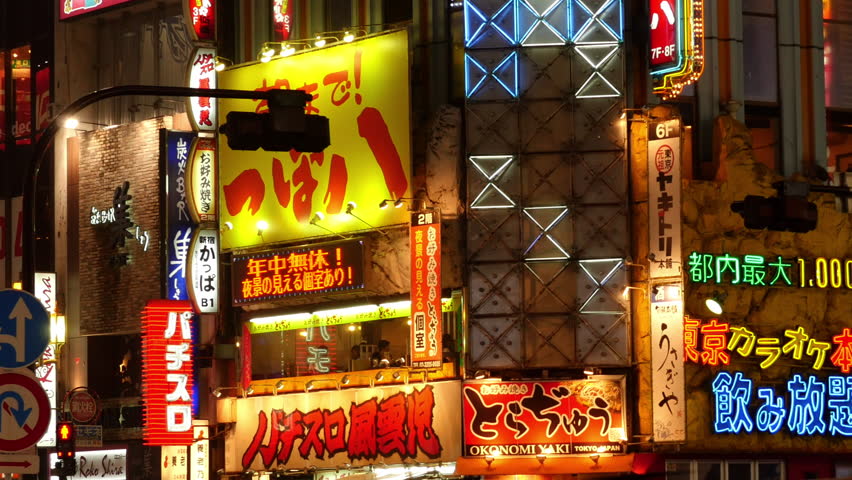
Find the location of `blue neon light chinese character`. blue neon light chinese character is located at coordinates (847, 409), (799, 406), (774, 417), (734, 409).